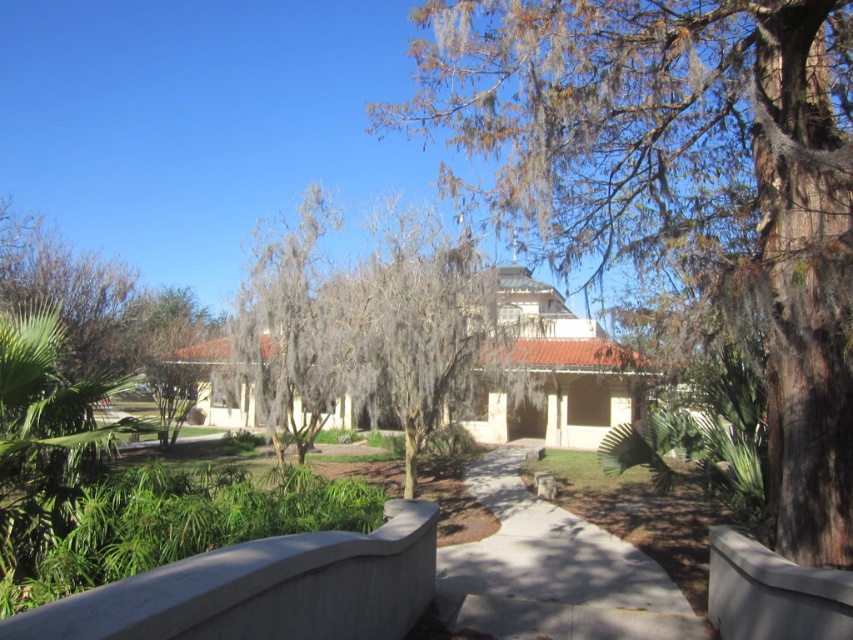
Is brown textured tree at upper center shorter than gray concrete pavement at center?

No.

Can you confirm if brown textured tree at upper center is positioned to the right of gray concrete pavement at center?

In fact, brown textured tree at upper center is to the left of gray concrete pavement at center.

I want to click on brown textured tree at upper center, so click(x=680, y=180).

Who is taller, gray/leathery tree at center or gray mossy tree at center?

gray/leathery tree at center

Does point (397, 259) come closer to viewer compared to point (260, 403)?

Yes, point (397, 259) is closer to viewer.

Between point (477, 292) and point (347, 326), which one is positioned behind?

Positioned behind is point (347, 326).

Identify the location of gray/leathery tree at center. The image size is (853, 640). (364, 330).

Which is more to the right, gray/leathery tree at center or gray concrete pavement at center?

gray concrete pavement at center is more to the right.

Find the location of a particular element. The image size is (853, 640). gray/leathery tree at center is located at coordinates (364, 330).

Locate an element on the screen. The image size is (853, 640). gray/leathery tree at center is located at coordinates (364, 330).